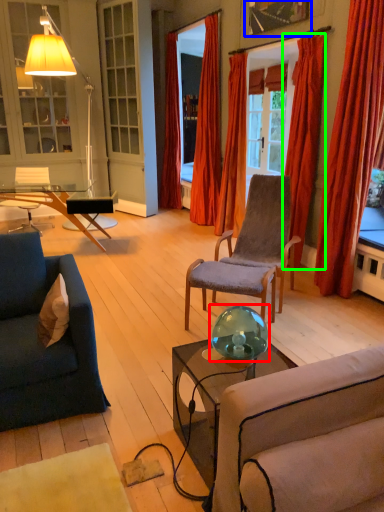
Question: Based on their relative distances, which object is nearer to teal (highlighted by a red box)? Choose from picture frame (highlighted by a blue box) and curtain (highlighted by a green box).

Choices:
 (A) picture frame
 (B) curtain

Answer: (B)